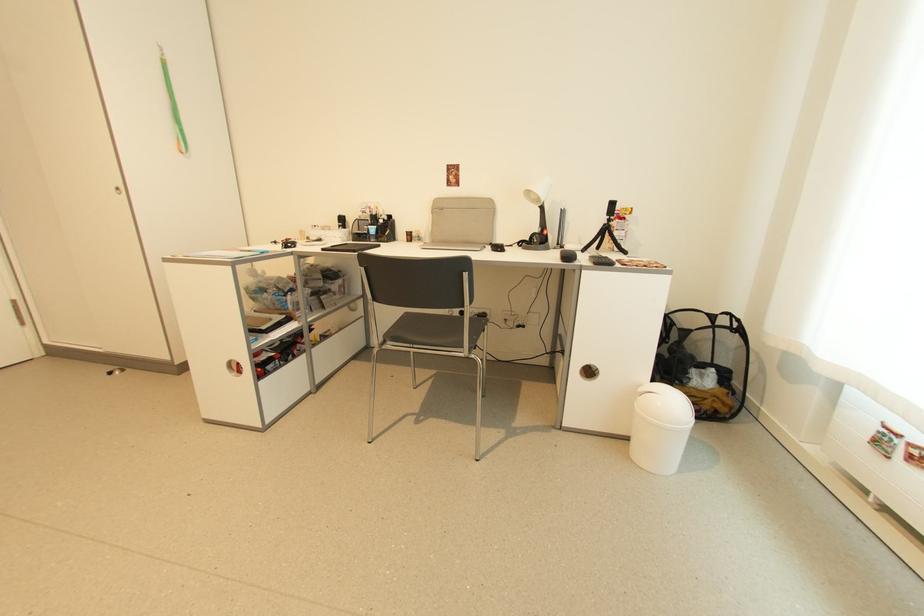
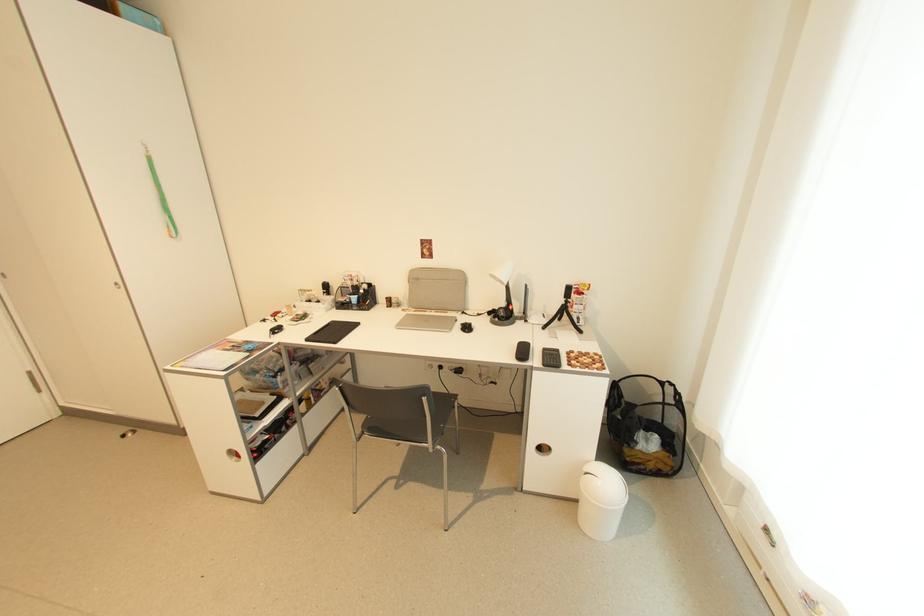
Where in the second image is the point corresponding to pixel 236 374 from the first image?

(237, 460)